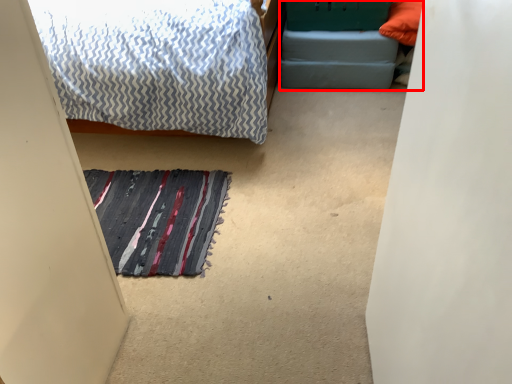
Question: Observing the image, what is the correct spatial positioning of bed frame (annotated by the red box) in reference to doormat?

Choices:
 (A) left
 (B) right

Answer: (B)